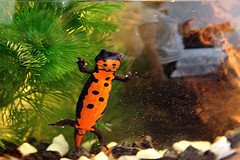
The image size is (240, 160). In order to click on right front leg in this screenshot , I will do tap(87, 69).